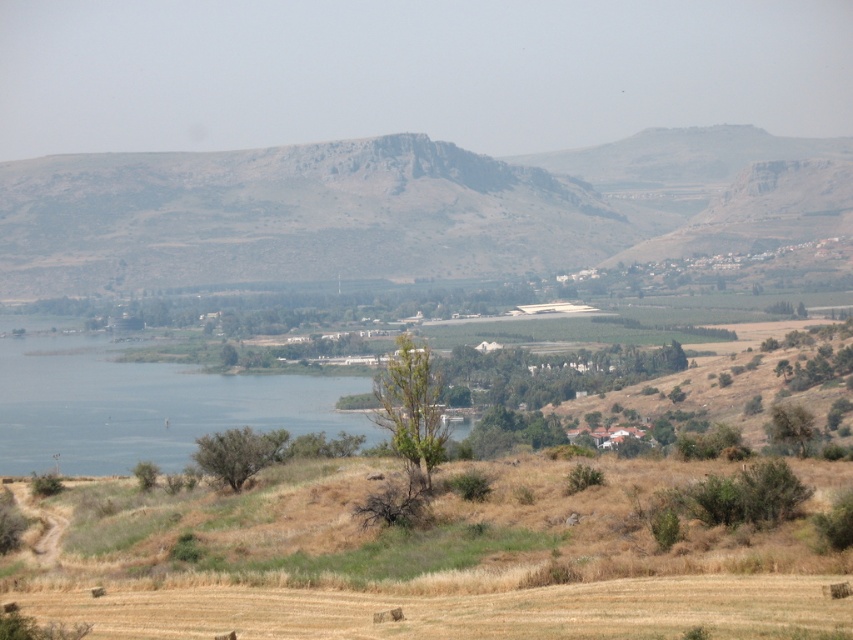
Question: Which point is farther to the camera?

Choices:
 (A) rugged stone mountain at center
 (B) blue water at center

Answer: (A)

Question: Is rugged stone mountain at center bigger than blue water at center?

Choices:
 (A) yes
 (B) no

Answer: (A)

Question: Can you confirm if rugged stone mountain at center is positioned below blue water at center?

Choices:
 (A) yes
 (B) no

Answer: (B)

Question: Is rugged stone mountain at center wider than blue water at center?

Choices:
 (A) yes
 (B) no

Answer: (A)

Question: Which point is farther from the camera taking this photo?

Choices:
 (A) (3, 209)
 (B) (83, 372)

Answer: (A)